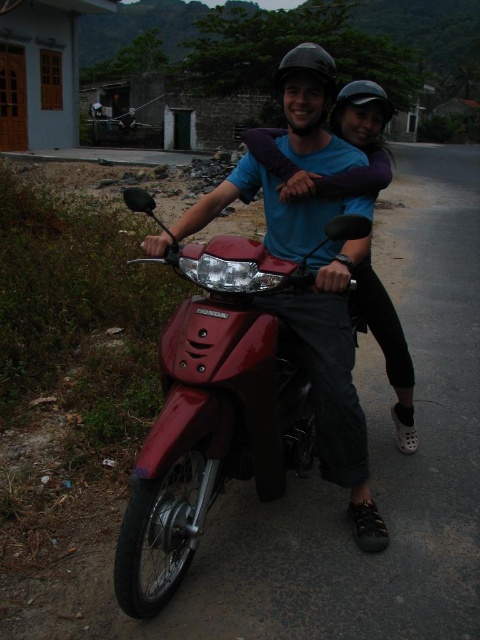
Is glossy red motorcycle at center closer to camera compared to matte purple shirt at center?

Yes, it is.

Is the position of glossy red motorcycle at center more distant than that of matte purple shirt at center?

No, glossy red motorcycle at center is in front of matte purple shirt at center.

Does point (190, 346) come behind point (410, 362)?

That is False.

Identify the location of glossy red motorcycle at center. The height and width of the screenshot is (640, 480). (213, 406).